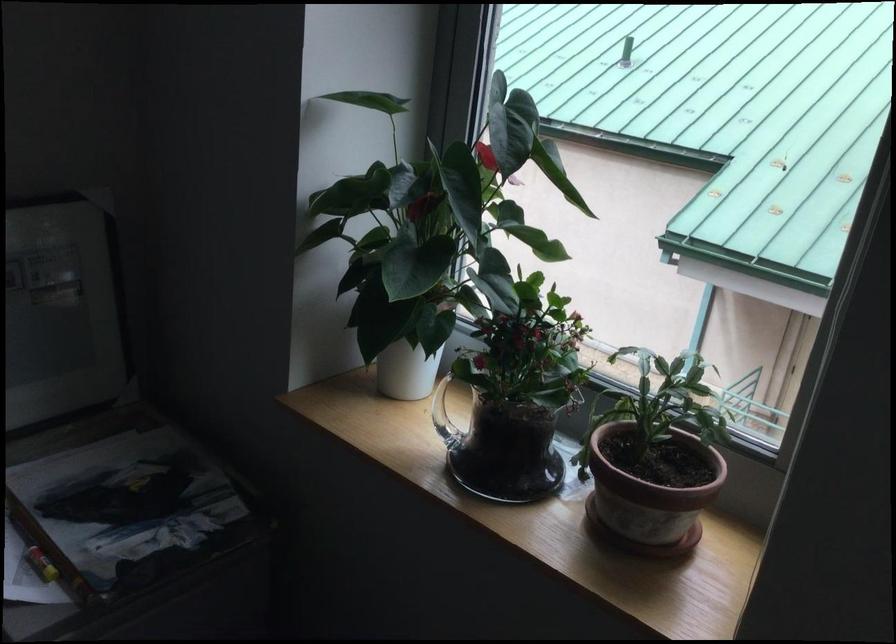
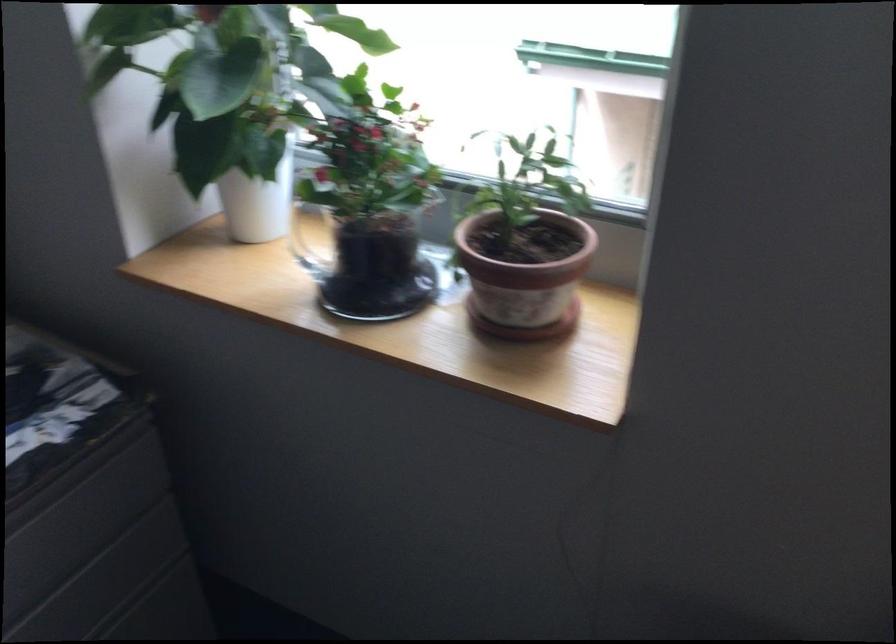
Question: How did the camera likely rotate?

Choices:
 (A) Left
 (B) Right
 (C) Up
 (D) Down

Answer: (D)